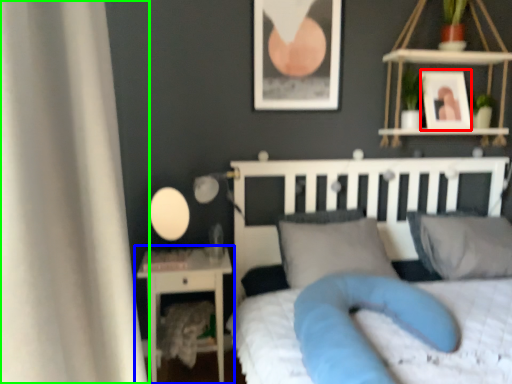
Question: Considering the real-world distances, which object is farthest from picture frame (highlighted by a red box)? nightstand (highlighted by a blue box) or curtain (highlighted by a green box)?

Choices:
 (A) nightstand
 (B) curtain

Answer: (B)